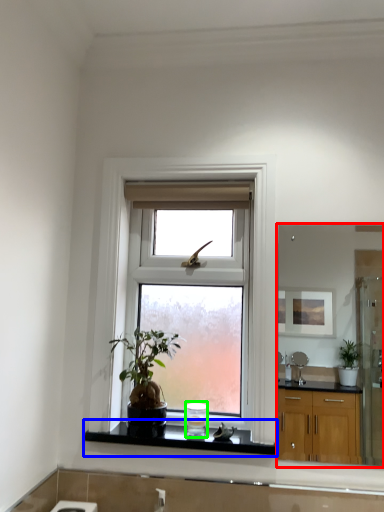
Question: Estimate the real-world distances between objects in this image. Which object is farther from mirror (highlighted by a red box), window sill (highlighted by a blue box) or appliance (highlighted by a green box)?

Choices:
 (A) window sill
 (B) appliance

Answer: (A)